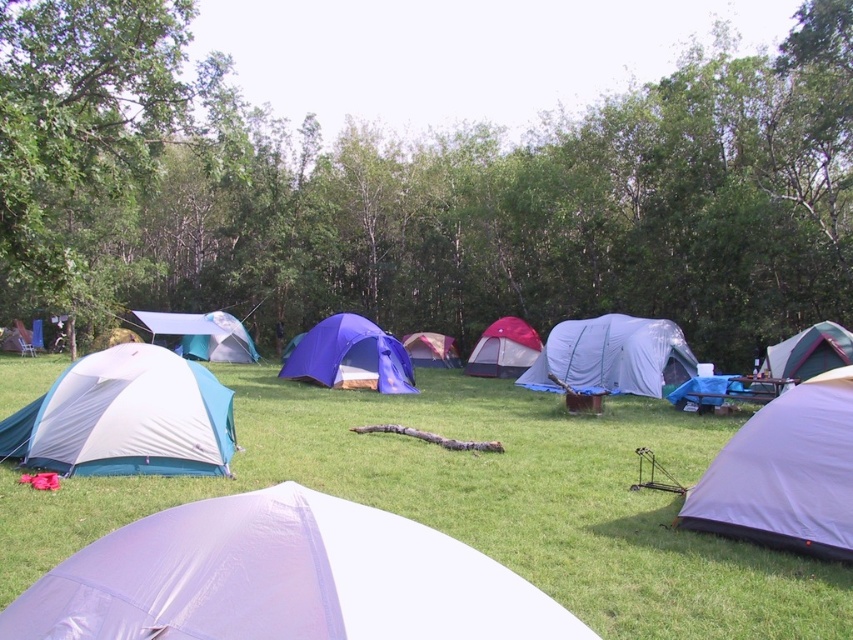
Who is positioned more to the left, green leafy tree at center or matte pink tent at center?

green leafy tree at center is more to the left.

Is green leafy tree at center wider than matte pink tent at center?

Indeed, green leafy tree at center has a greater width compared to matte pink tent at center.

Does point (189, 186) come behind point (456, 358)?

Yes, point (189, 186) is behind point (456, 358).

In order to click on green leafy tree at center in this screenshot , I will do `click(431, 195)`.

Who is lower down, matte blue tent at center or green fabric tent at right?

matte blue tent at center

Is point (288, 371) farther from viewer compared to point (822, 360)?

Yes, it is.

Between point (387, 360) and point (801, 362), which one is positioned behind?

The point (387, 360) is behind.

Locate an element on the screen. The image size is (853, 640). matte blue tent at center is located at coordinates [x=350, y=356].

From the picture: Does white glossy tent at lower center have a lesser height compared to gray fabric tent at center?

Correct, white glossy tent at lower center is not as tall as gray fabric tent at center.

Is white glossy tent at lower center smaller than gray fabric tent at center?

Yes, white glossy tent at lower center is smaller than gray fabric tent at center.

Is point (50, 618) positioned behind point (561, 352)?

No.

Locate an element on the screen. white glossy tent at lower center is located at coordinates (282, 579).